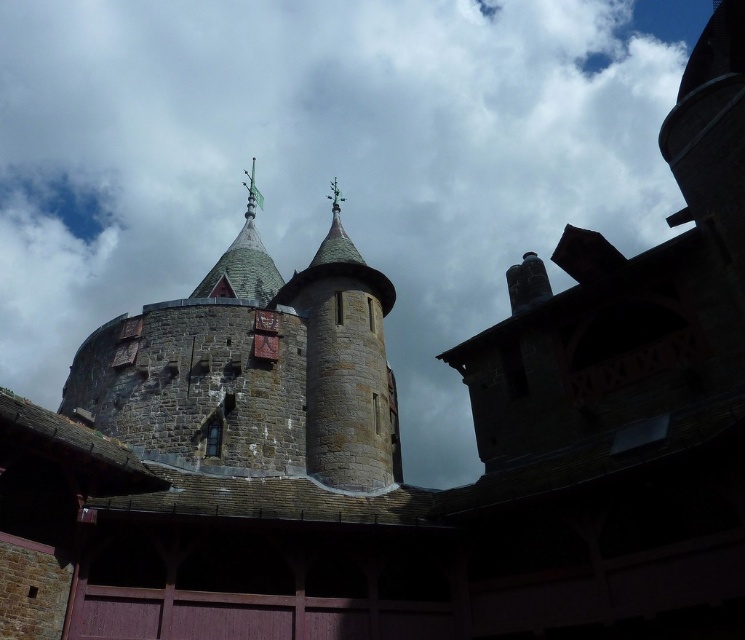
Question: Is white fluffy cloud at upper center to the right of stone tower at upper center from the viewer's perspective?

Choices:
 (A) no
 (B) yes

Answer: (B)

Question: Which object appears closest to the camera in this image?

Choices:
 (A) white fluffy cloud at upper center
 (B) stone tower at upper center

Answer: (B)

Question: Which point is farther to the camera?

Choices:
 (A) (133, 388)
 (B) (425, 237)

Answer: (B)

Question: Is white fluffy cloud at upper center wider than stone tower at upper center?

Choices:
 (A) no
 (B) yes

Answer: (B)

Question: Which point is farther to the camera?

Choices:
 (A) stone tower at upper center
 (B) white fluffy cloud at upper center

Answer: (B)

Question: Observing the image, what is the correct spatial positioning of white fluffy cloud at upper center in reference to stone tower at upper center?

Choices:
 (A) left
 (B) right

Answer: (B)